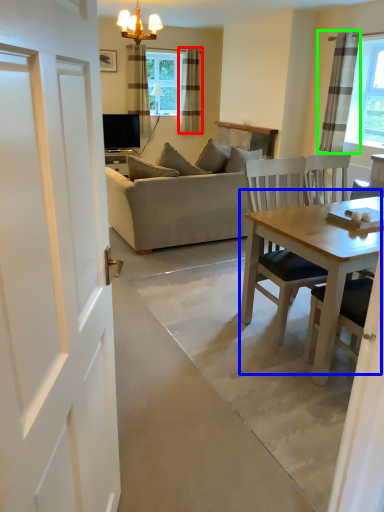
Question: Estimate the real-world distances between objects in this image. Which object is farther from curtain (highlighted by a red box), table (highlighted by a blue box) or curtain (highlighted by a green box)?

Choices:
 (A) table
 (B) curtain

Answer: (A)